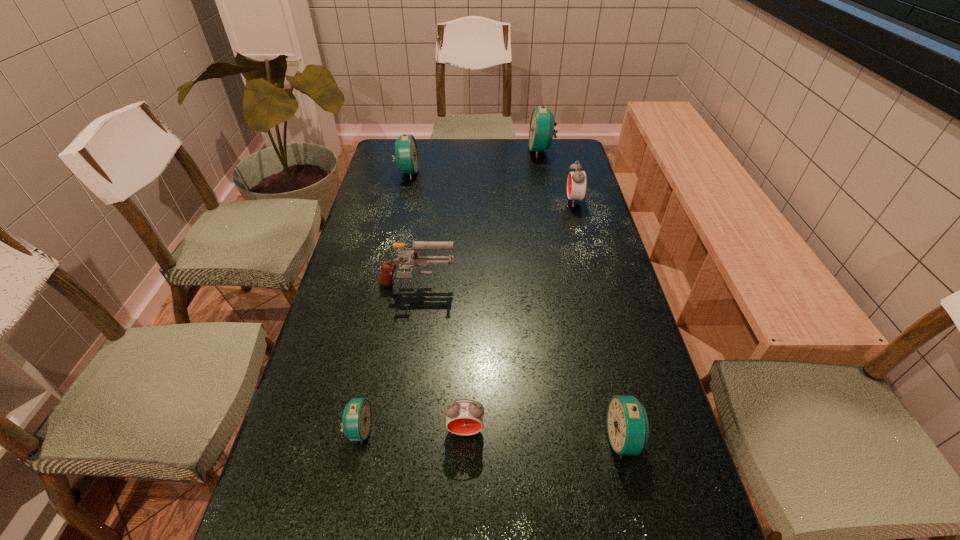
The width and height of the screenshot is (960, 540). What are the coordinates of `the shortest object` in the screenshot? It's located at (356, 419).

Where is `the shortest alarm clock`? The width and height of the screenshot is (960, 540). the shortest alarm clock is located at coordinates (356, 419).

Identify the location of vacant region located on the front-facing side of the tallest alarm clock. (456, 151).

Where is `blank space located 0.310m on the front-facing side of the tallest alarm clock`? Image resolution: width=960 pixels, height=540 pixels. blank space located 0.310m on the front-facing side of the tallest alarm clock is located at coordinates (451, 151).

Find the location of a particular element. The height and width of the screenshot is (540, 960). free region located on the front-facing side of the tallest alarm clock is located at coordinates (466, 151).

Where is `vacant space positioned 0.250m on the face of the bigger red alarm clock`? The height and width of the screenshot is (540, 960). vacant space positioned 0.250m on the face of the bigger red alarm clock is located at coordinates (493, 201).

Identify the location of free location located on the face of the bigger red alarm clock. Image resolution: width=960 pixels, height=540 pixels. [x=508, y=201].

The image size is (960, 540). I want to click on blank area located 0.200m on the face of the bigger red alarm clock, so click(508, 201).

Where is `vacant space positioned 0.060m on the front-facing side of the third nearest blue alarm clock`? Image resolution: width=960 pixels, height=540 pixels. vacant space positioned 0.060m on the front-facing side of the third nearest blue alarm clock is located at coordinates (435, 172).

This screenshot has height=540, width=960. I want to click on vacant region located at the barrel end of the gun, so click(x=502, y=288).